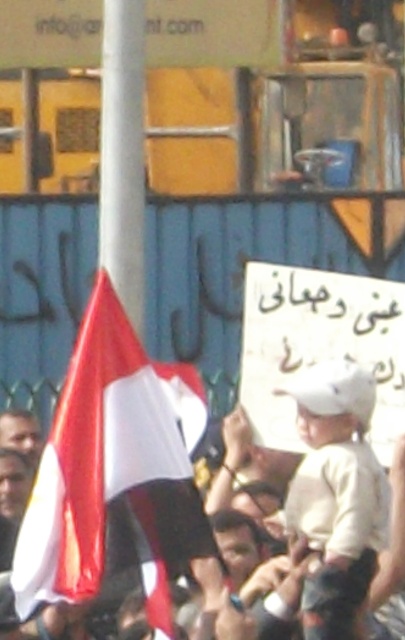
Consider the image. Can you confirm if white fabric flag at center is positioned to the left of white paper placard at center?

Yes, white fabric flag at center is to the left of white paper placard at center.

Looking at this image, who is more distant from viewer, (112, 499) or (294, 416)?

Point (294, 416)

Does point (104, 538) lie behind point (277, 266)?

No, (104, 538) is closer to viewer.

Identify the location of white fabric flag at center. (110, 477).

In the scene shown: Can you confirm if white paper placard at center is thinner than white cotton hat at center?

No, white paper placard at center is not thinner than white cotton hat at center.

Who is positioned more to the right, white paper placard at center or white cotton hat at center?

white paper placard at center

Is point (253, 428) farther from camera compared to point (338, 621)?

Yes, point (253, 428) is farther from viewer.

The image size is (405, 640). What are the coordinates of `white paper placard at center` in the screenshot? It's located at (319, 346).

Is point (132, 480) less distant than point (319, 612)?

Yes, it is.

Does white fabric flag at center appear on the left side of white cotton hat at center?

Correct, you'll find white fabric flag at center to the left of white cotton hat at center.

Which is in front, point (61, 573) or point (324, 404)?

Point (61, 573) is more forward.

The width and height of the screenshot is (405, 640). What are the coordinates of `white fabric flag at center` in the screenshot? It's located at (110, 477).